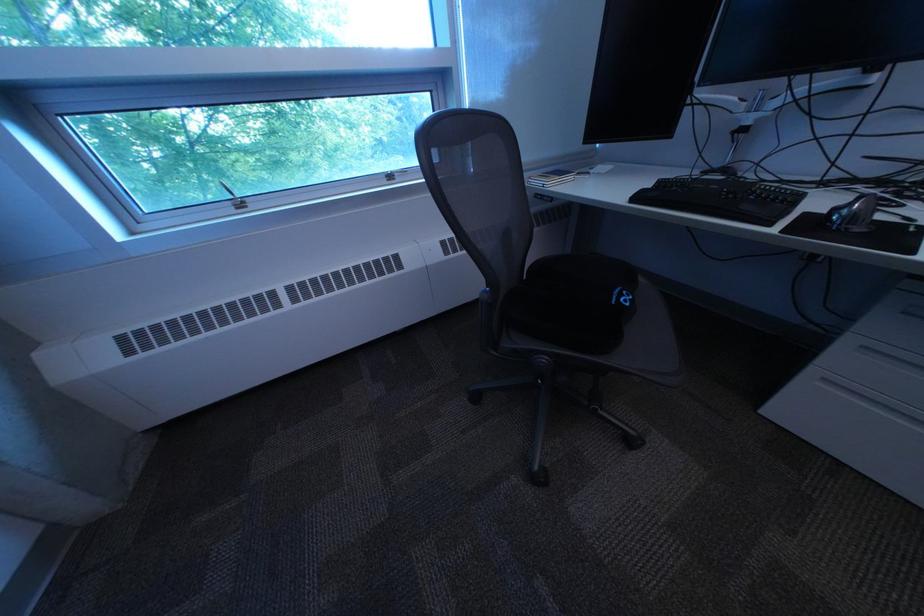
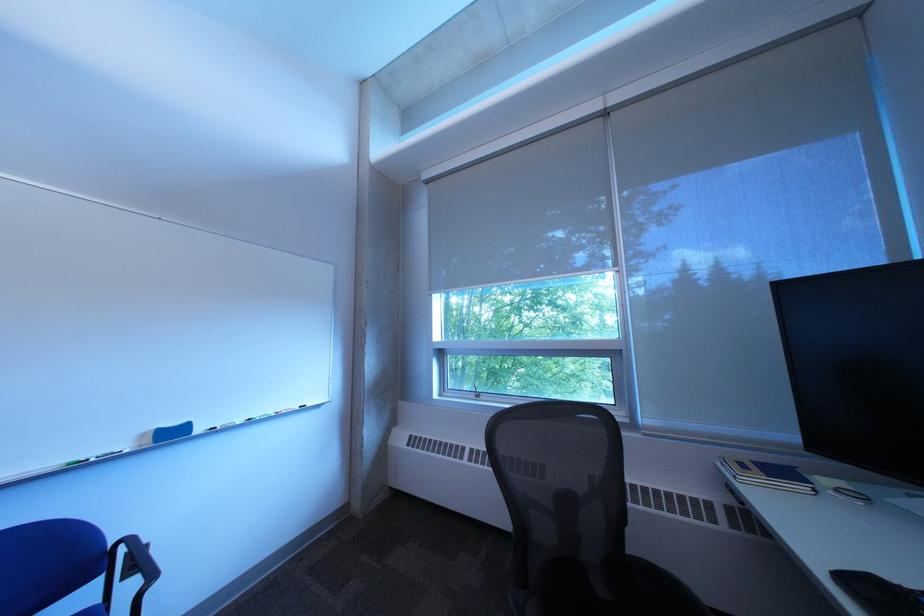
Where in the second image is the point corresponding to [650,200] from the first image?

(860, 582)